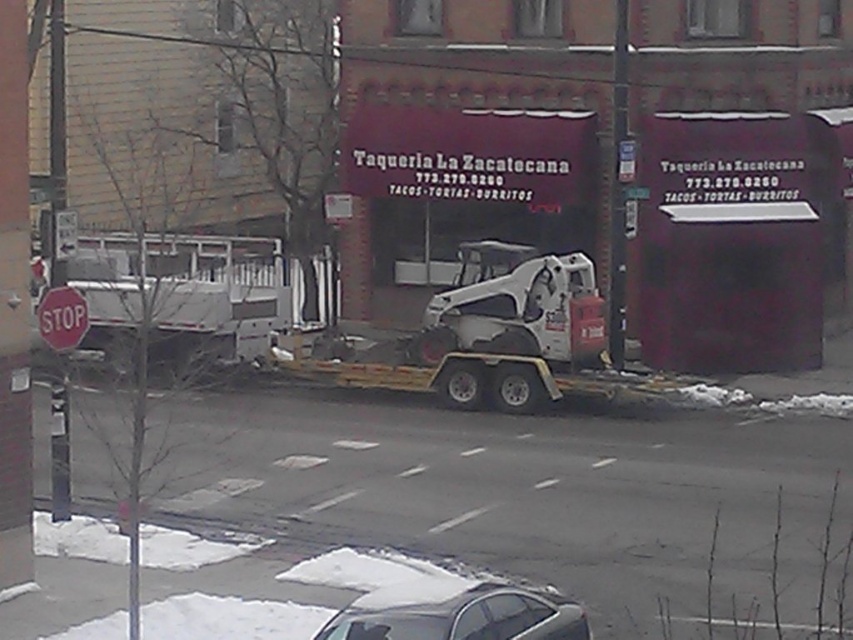
Question: Which of the following is the farthest from the observer?

Choices:
 (A) (99, 344)
 (B) (379, 612)
 (C) (590, 324)

Answer: (A)

Question: Is white matte skid steer loader at center further to the viewer compared to silver metallic car at lower center?

Choices:
 (A) no
 (B) yes

Answer: (B)

Question: Which of the following is the closest to the observer?

Choices:
 (A) (68, 333)
 (B) (207, 260)
 (C) (473, 260)
 (D) (503, 620)

Answer: (D)

Question: Which of these objects is positioned closest to the silver metallic car at lower center?

Choices:
 (A) white matte skid steer loader at center
 (B) red matte stop sign at lower left

Answer: (B)

Question: Is white matte trailer truck at left positioned before white matte skid steer loader at center?

Choices:
 (A) yes
 (B) no

Answer: (A)

Question: Is silver metallic car at lower center positioned before red matte stop sign at lower left?

Choices:
 (A) no
 (B) yes

Answer: (B)